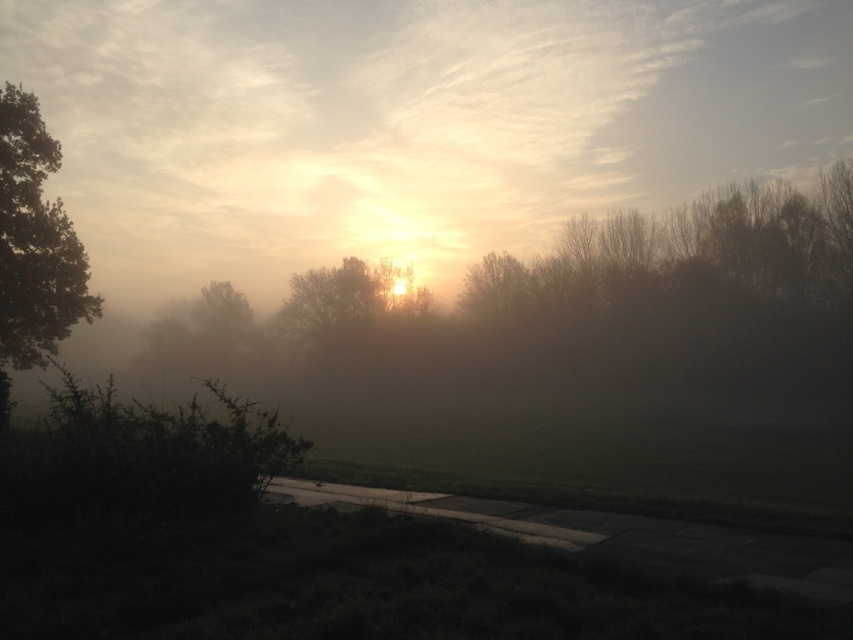
Question: Is foggy sky at center below green matte tree at left?

Choices:
 (A) yes
 (B) no

Answer: (B)

Question: Which object appears farthest from the camera in this image?

Choices:
 (A) green matte tree at left
 (B) foggy sky at center

Answer: (B)

Question: Which point appears closest to the camera in this image?

Choices:
 (A) (405, 12)
 (B) (50, 252)

Answer: (B)

Question: Considering the relative positions of foggy sky at center and green matte tree at left in the image provided, where is foggy sky at center located with respect to green matte tree at left?

Choices:
 (A) above
 (B) below

Answer: (A)

Question: Can you confirm if foggy sky at center is wider than green matte tree at left?

Choices:
 (A) yes
 (B) no

Answer: (A)

Question: Among these points, which one is farthest from the camera?

Choices:
 (A) (55, 317)
 (B) (254, 49)

Answer: (B)